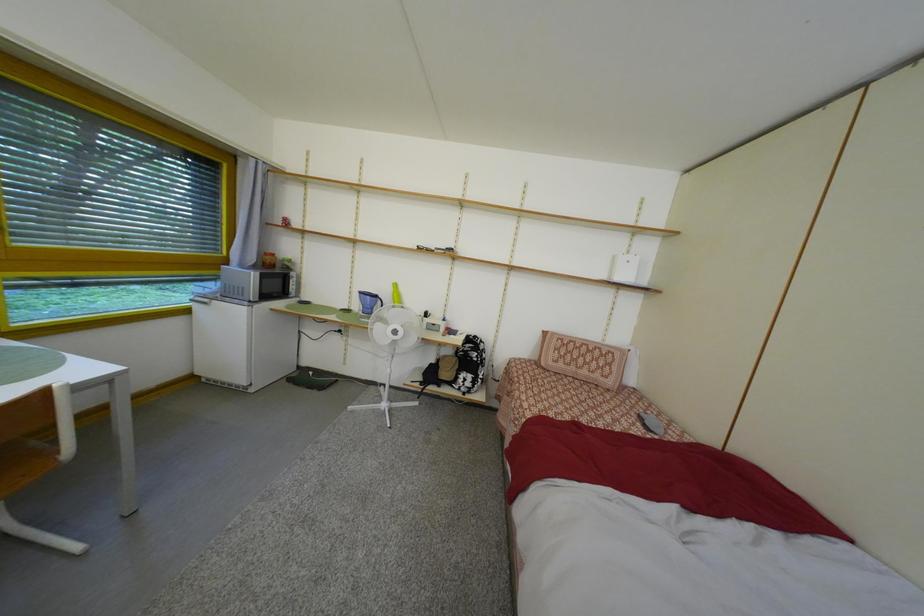
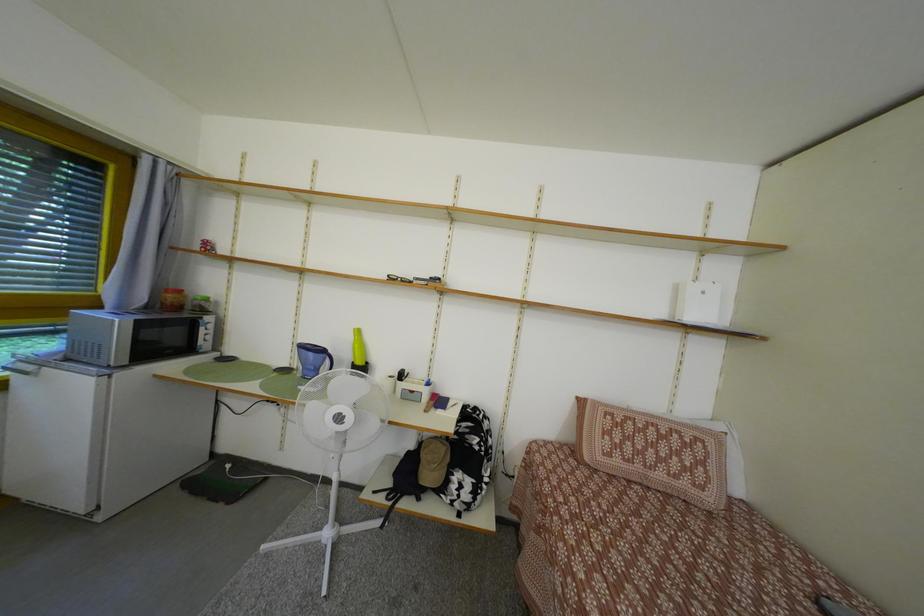
Question: Which direction would the cameraman need to move to produce the second image? Reply with the corresponding letter.

Choices:
 (A) Left
 (B) Right
 (C) Forward
 (D) Backward

Answer: (C)